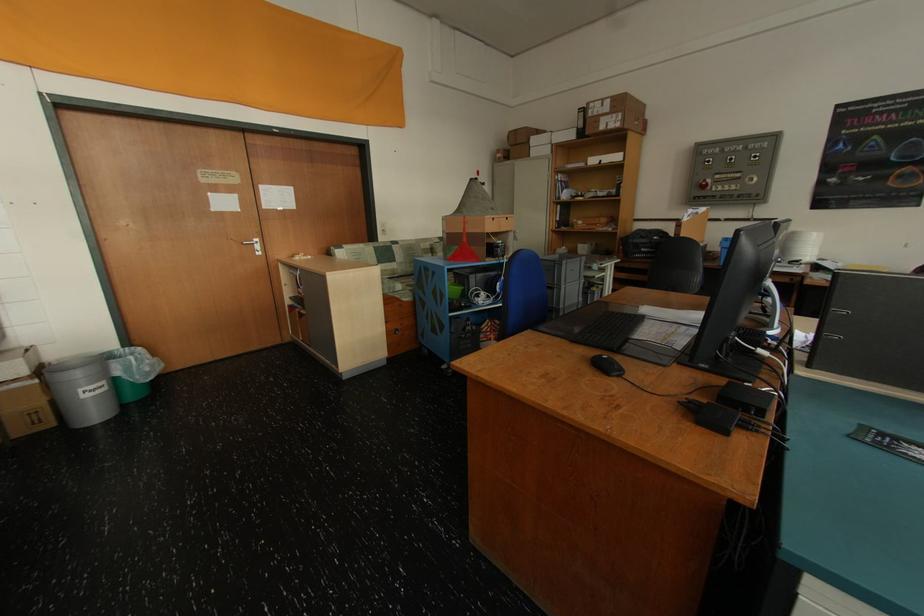
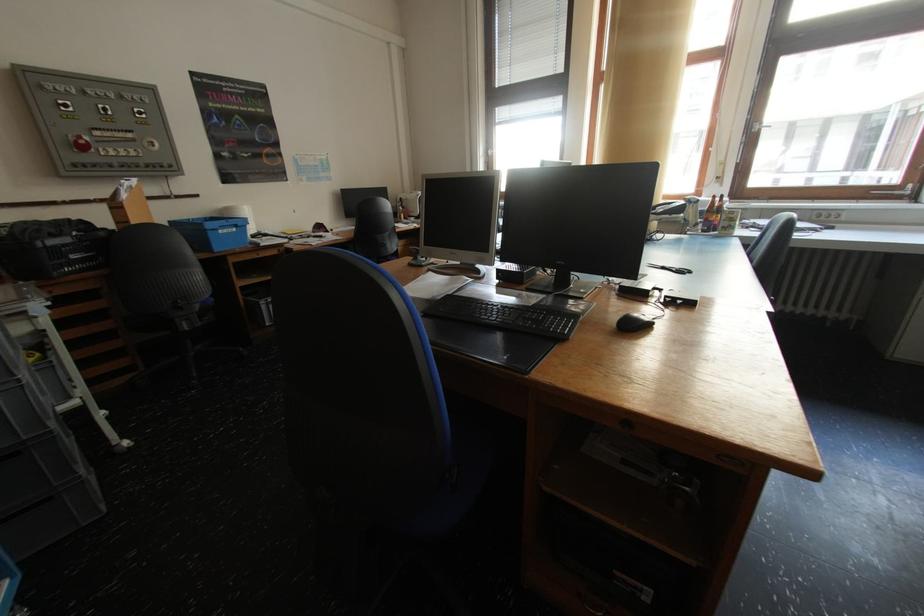
Locate, in the second image, the point that corresponds to point 711,188 in the first image.

(91, 148)